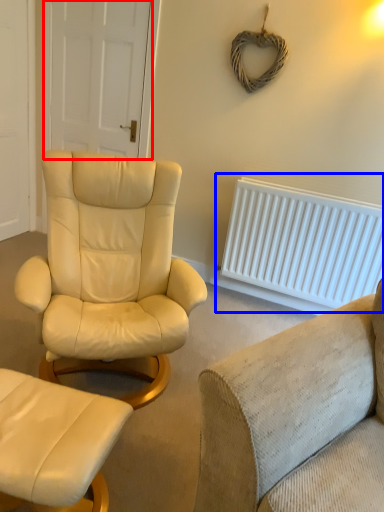
Question: Which object appears closest to the camera in this image, door (highlighted by a red box) or radiator (highlighted by a blue box)?

Choices:
 (A) door
 (B) radiator

Answer: (B)